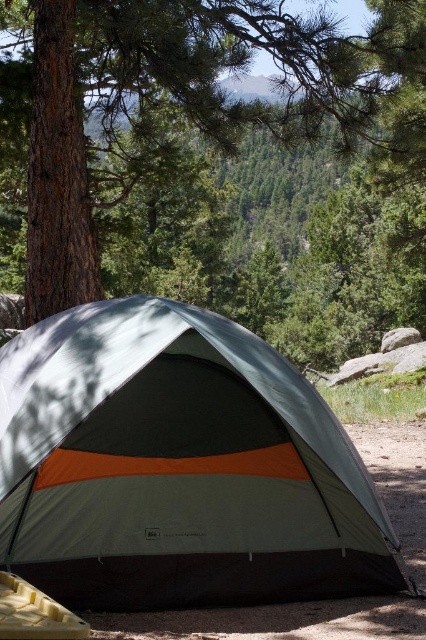
You are setting up a campsite and need to know if the orange fabric tent at center can fit between the green rough bark tree at center and another tree 2 meters away. Can it?

The green rough bark tree at center might be wider than orange fabric tent at center, so it is uncertain if the tent can fit without overlapping the tree. Check the exact width of both the tree and the tent before deciding.

You are a hiker who wants to measure the distance between yourself and the green rough bark tree at center. You have a measuring tape that can extend up to 8 meters. Can you measure the distance directly using your tape?

The distance between you and the green rough bark tree at center is 7.77 meters, which is within the 8 meter limit of your measuring tape. Therefore, you can measure the distance directly using your tape.